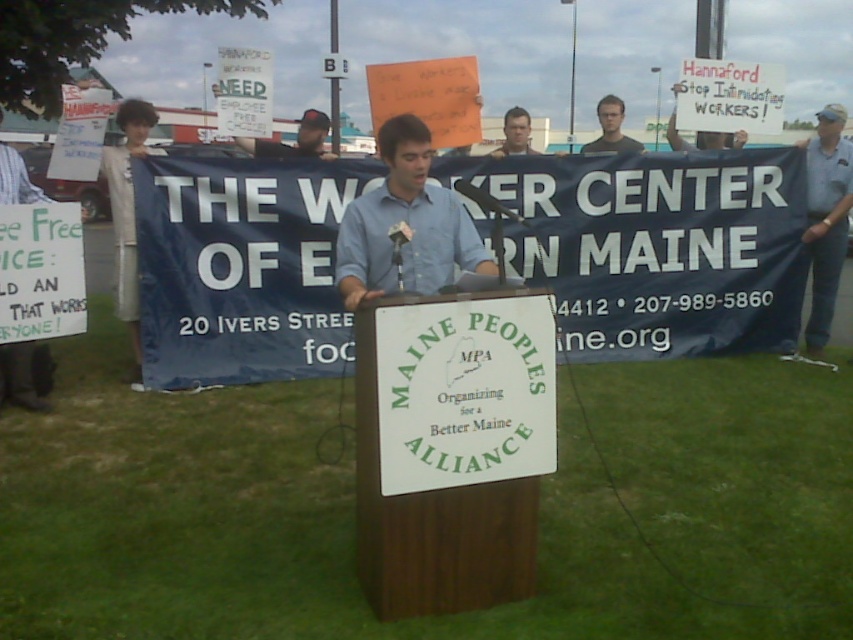
Does dark blue shirt at center appear under matte black shirt at center?

Yes, dark blue shirt at center is below matte black shirt at center.

Does point (306, 124) lie behind point (610, 100)?

No, (306, 124) is closer to viewer.

Where is `dark blue shirt at center`? The width and height of the screenshot is (853, 640). dark blue shirt at center is located at coordinates (296, 140).

Is blue shirt at center taller than blue denim jeans at right?

No, blue shirt at center is not taller than blue denim jeans at right.

Identify the location of blue shirt at center. Image resolution: width=853 pixels, height=640 pixels. (405, 224).

Locate an element on the screen. The height and width of the screenshot is (640, 853). blue shirt at center is located at coordinates (405, 224).

Is blue denim jeans at right behind matte black shirt at center?

No, blue denim jeans at right is closer to the viewer.

Does blue denim jeans at right have a greater width compared to matte black shirt at center?

Yes.

Where is `blue denim jeans at right`? This screenshot has width=853, height=640. blue denim jeans at right is located at coordinates (827, 218).